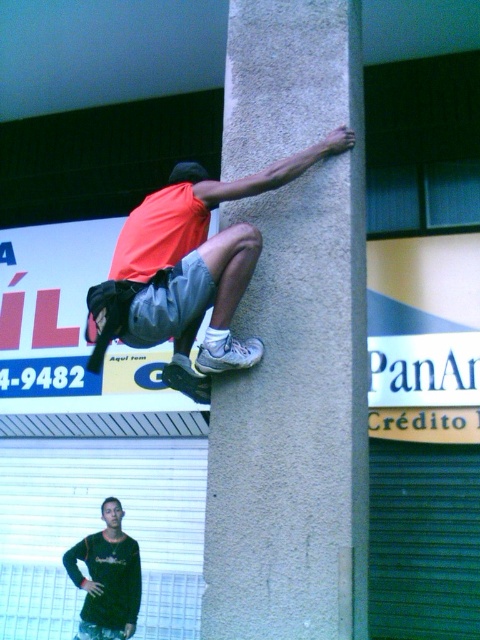
Question: Which object appears closest to the camera in this image?

Choices:
 (A) gray concrete pillar at center
 (B) orange fabric skateboard at upper center

Answer: (A)

Question: Among these objects, which one is nearest to the camera?

Choices:
 (A) gray concrete pillar at center
 (B) orange fabric skateboard at upper center

Answer: (A)

Question: Can you confirm if gray concrete pillar at center is bigger than orange fabric skateboard at upper center?

Choices:
 (A) no
 (B) yes

Answer: (B)

Question: Considering the relative positions of orange fabric skateboard at upper center and black matte shirt at lower left in the image provided, where is orange fabric skateboard at upper center located with respect to black matte shirt at lower left?

Choices:
 (A) left
 (B) right

Answer: (B)

Question: Does gray concrete pillar at center appear under black matte shirt at lower left?

Choices:
 (A) yes
 (B) no

Answer: (B)

Question: Estimate the real-world distances between objects in this image. Which object is closer to the gray concrete pillar at center?

Choices:
 (A) orange fabric skateboard at upper center
 (B) black matte shirt at lower left

Answer: (A)